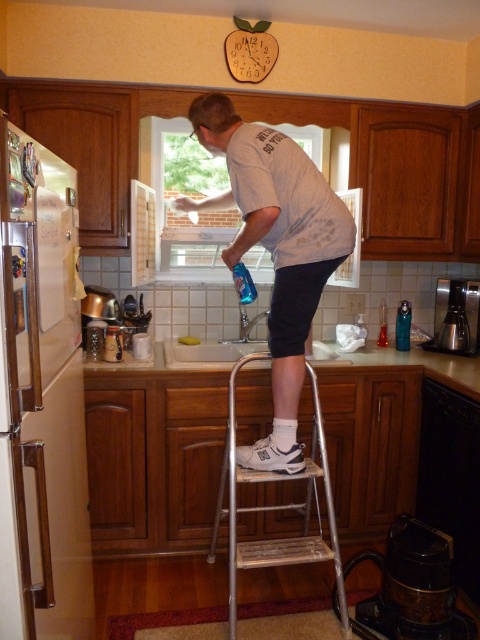
Question: Can you confirm if silver metallic step stool at center is thinner than white ceramic sink at center?

Choices:
 (A) yes
 (B) no

Answer: (B)

Question: Does black plastic dishwasher at lower right appear over white ceramic sink at center?

Choices:
 (A) yes
 (B) no

Answer: (B)

Question: Which of the following is the closest to the observer?

Choices:
 (A) 434,410
 (B) 345,358

Answer: (A)

Question: Which of the following is the farthest from the observer?

Choices:
 (A) white glossy countertop at center
 (B) black plastic dishwasher at lower right
 (C) white cotton shirt at center

Answer: (A)

Question: Which point is farther from the camera taking this photo?

Choices:
 (A) click(207, 364)
 (B) click(254, 358)
 (C) click(213, 129)

Answer: (A)

Question: Does white cotton shirt at center have a larger size compared to white glossy countertop at center?

Choices:
 (A) yes
 (B) no

Answer: (A)